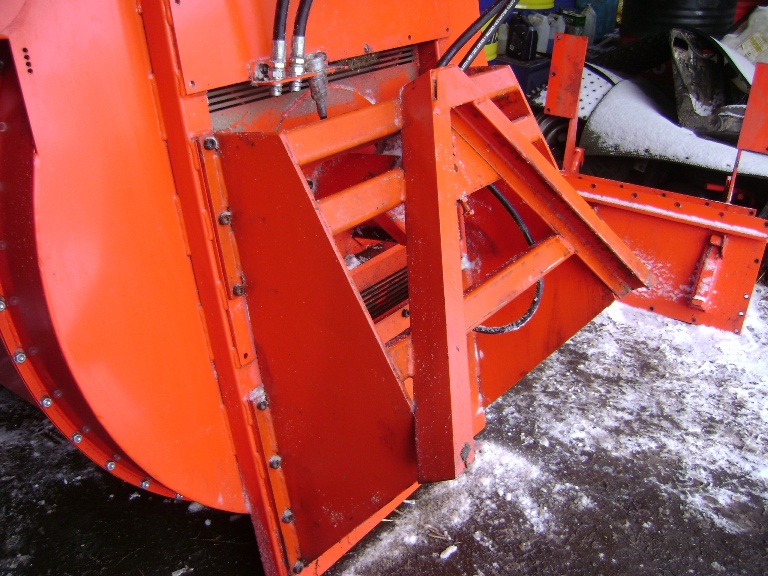
Where is `cable`? The height and width of the screenshot is (576, 768). cable is located at coordinates (524, 317).